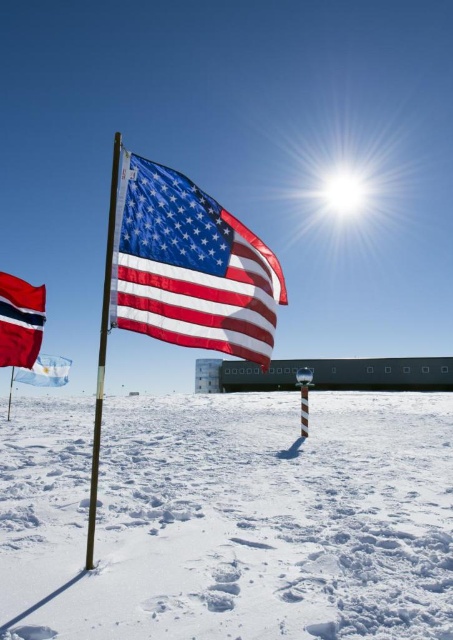
You are a flag installer who needs to place a new flag that is 1.5 meters wide between the matte fabric flag at center and the red fabric flag at lower left. Will there be enough space to fit it without overlapping either flag?

The distance between the matte fabric flag at center and the red fabric flag at lower left is 1.80 meters. Since the new flag is 1.5 meters wide, there is sufficient space to place it between them without overlapping, as 1.5 meters is less than the available 1.80 meters.

You are a photographer trying to capture the red fabric flag at lower left and the metallic silver flag pole at center in a single frame. Since you want the flag to be more prominent in the photo, which object should you focus on to ensure it appears larger in the image?

The red fabric flag at lower left has a larger width than the metallic silver flag pole at center, so focusing on the red fabric flag at lower left will make it appear larger in the photo.